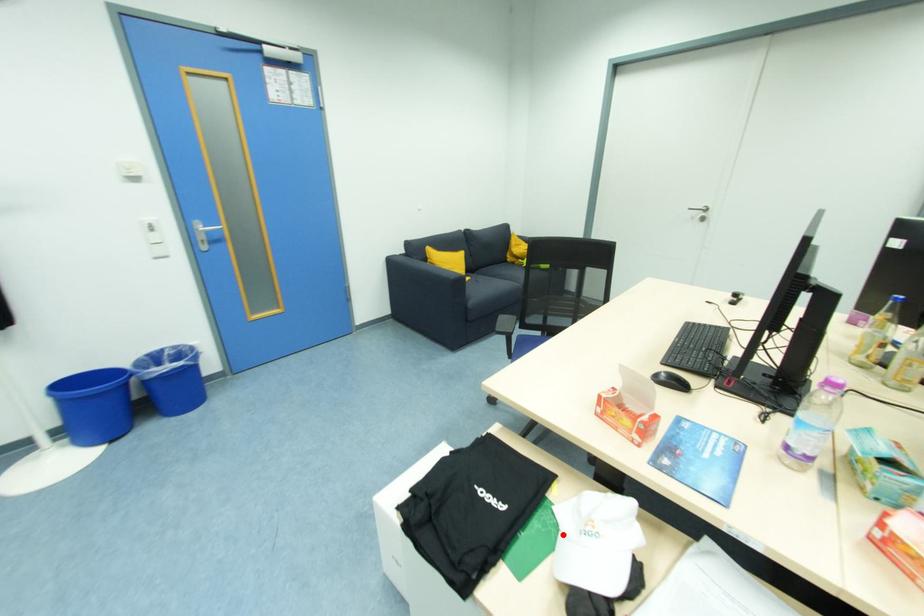
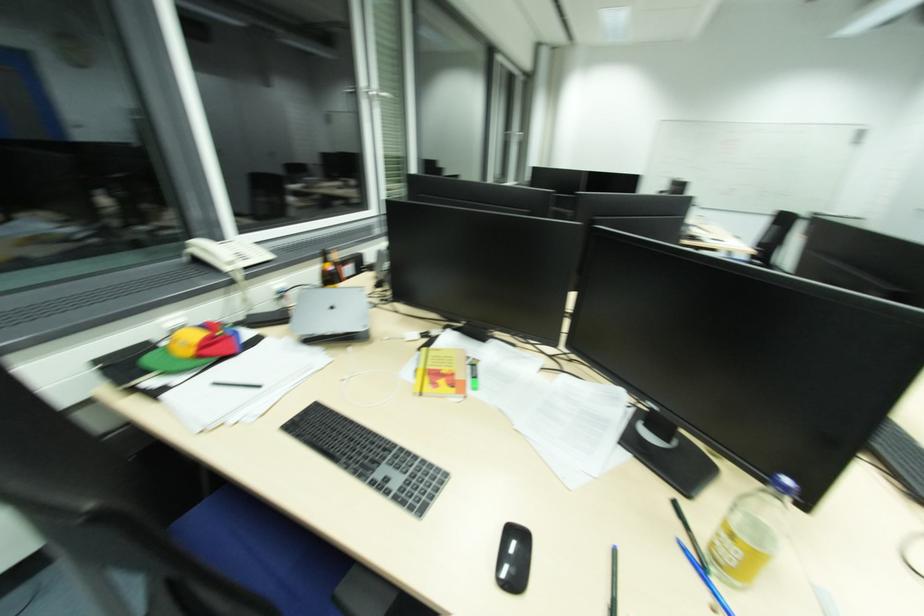
Question: I am providing you with two images of the same scene from different viewpoints. A red point is marked on the first image. Is the red point's position out of view in image 2?

Choices:
 (A) Yes
 (B) No

Answer: (A)